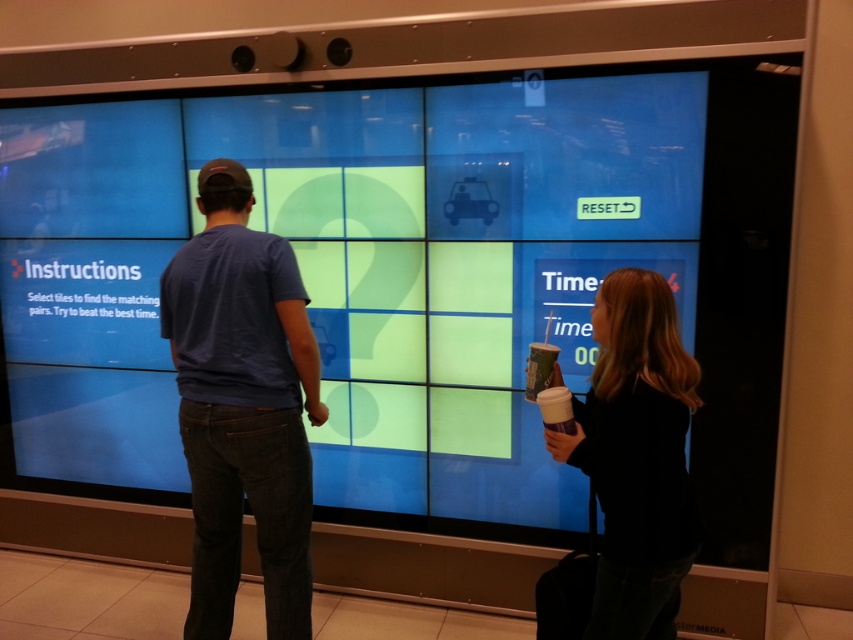
Between dark blue t-shirt at center and black matte hair at upper right, which one appears on the left side from the viewer's perspective?

dark blue t-shirt at center is more to the left.

Based on the photo, is dark blue t-shirt at center below black matte hair at upper right?

No, dark blue t-shirt at center is not below black matte hair at upper right.

Between point (178, 326) and point (668, 634), which one is positioned in front?

Point (668, 634) is more forward.

The height and width of the screenshot is (640, 853). I want to click on dark blue t-shirt at center, so click(x=242, y=404).